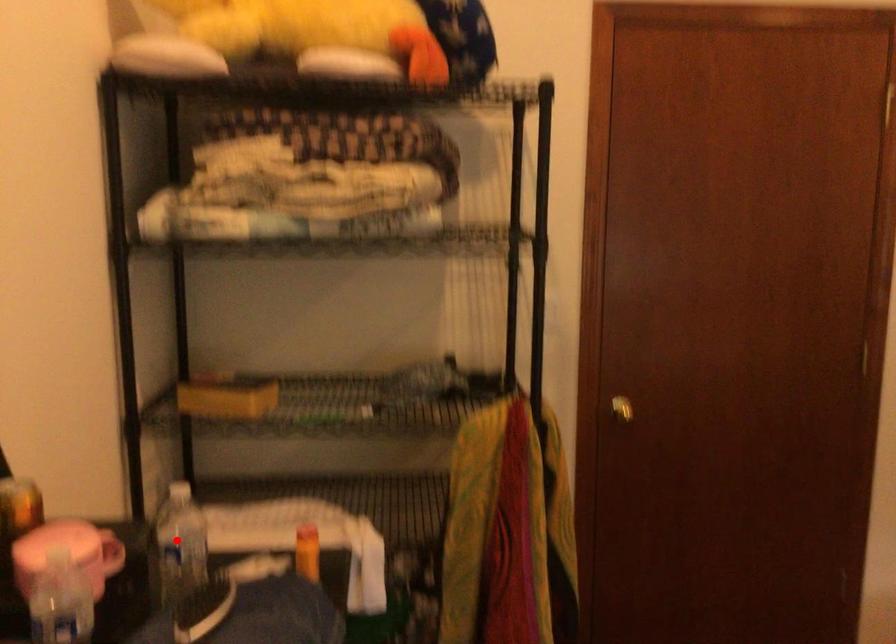
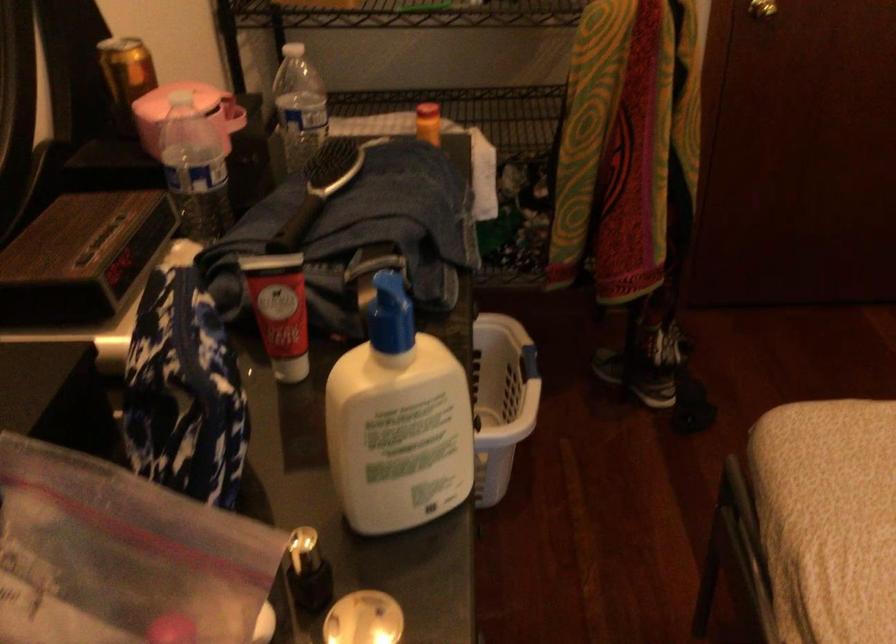
The point at the highlighted location is marked in the first image. Where is the corresponding point in the second image?

(298, 106)